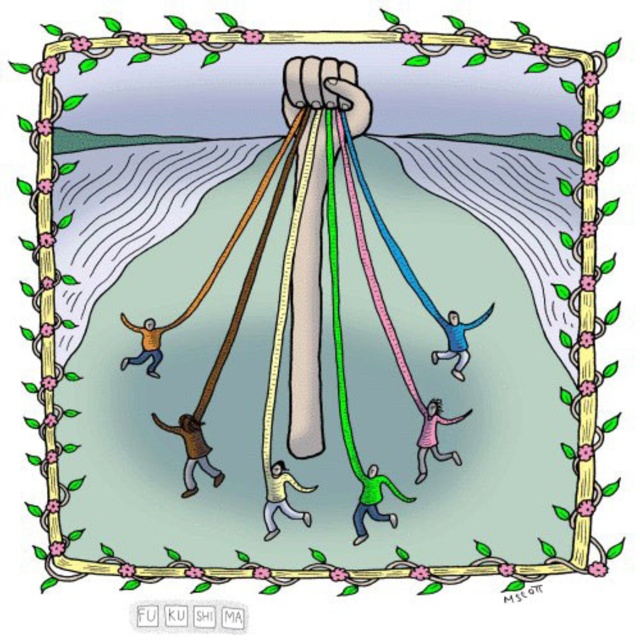
You are a photographer standing 1.5 meters away from the pink matte figure at center in the image. Can you safely take a photo without getting too close to the figure?

The distance between you and the pink matte figure at center is 1.5 meters, but the figure is already 1.28 meters away from the camera. This means you are only 0.22 meters closer than the figure to the camera. Since the camera focuses on the figure, your slight proximity might not interfere, but physically moving closer could disrupt the scene. It is safer to stay at your current position to avoid obstruction.

You are an artist trying to draw the scene. You need to decide the size of the pink matte figure at center and orange matte sweater at lower left. Based on the image, which object should be drawn larger?

The pink matte figure at center should be drawn larger because it is much taller than the orange matte sweater at lower left.

You are standing in front of the image and want to touch the brown matte pants at lower left and the green matte person at center. Which object can you reach first without moving your position?

The brown matte pants at lower left is closer to the viewer than the green matte person at center, so you can reach the brown matte pants at lower left first without moving your position.